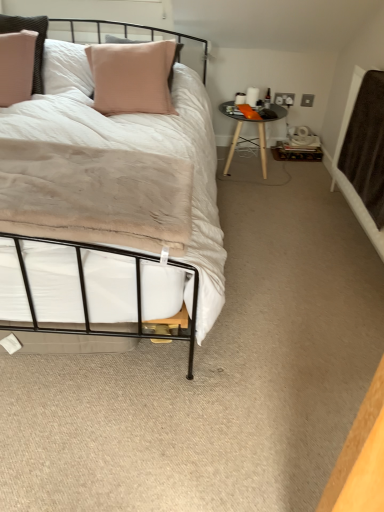
What do you see at coordinates (366, 146) in the screenshot? The width and height of the screenshot is (384, 512). I see `brown textured blanket at right` at bounding box center [366, 146].

You are a GUI agent. You are given a task and a screenshot of the screen. Output one action in this format:
    pyautogui.click(x=<x>, y=<y>)
    Task: Click on the brown textured blanket at right
    The width and height of the screenshot is (384, 512).
    Given the screenshot: What is the action you would take?
    pyautogui.click(x=366, y=146)

Measure the distance between brown textured blanket at right and camera.

A distance of 6.46 feet exists between brown textured blanket at right and camera.

Image resolution: width=384 pixels, height=512 pixels. Find the location of `black glossy table at center right`. black glossy table at center right is located at coordinates (239, 136).

What do you see at coordinates (239, 136) in the screenshot? I see `black glossy table at center right` at bounding box center [239, 136].

Find the location of a particular element. brown textured blanket at right is located at coordinates (366, 146).

Which is more to the right, black glossy table at center right or brown textured blanket at right?

From the viewer's perspective, brown textured blanket at right appears more on the right side.

Is black glossy table at center right behind brown textured blanket at right?

That is True.

Is point (261, 119) closer or farther from the camera than point (367, 140)?

Clearly, point (261, 119) is more distant from the camera than point (367, 140).

Looking at this image, from the image's perspective, which is below, black glossy table at center right or brown textured blanket at right?

brown textured blanket at right, from the image's perspective.

From a real-world perspective, does black glossy table at center right stand above brown textured blanket at right?

No, from a real-world perspective, black glossy table at center right is not on top of brown textured blanket at right.

Is black glossy table at center right wider or thinner than brown textured blanket at right?

black glossy table at center right is wider than brown textured blanket at right.

Does black glossy table at center right have a lesser height compared to brown textured blanket at right?

Correct, black glossy table at center right is not as tall as brown textured blanket at right.

Based on the photo, is black glossy table at center right smaller than brown textured blanket at right?

Actually, black glossy table at center right might be larger than brown textured blanket at right.

Can we say black glossy table at center right lies outside brown textured blanket at right?

Yes, black glossy table at center right is located beyond the bounds of brown textured blanket at right.

Is black glossy table at center right not near brown textured blanket at right?

No, there isn't a large distance between black glossy table at center right and brown textured blanket at right.

Is black glossy table at center right aimed at brown textured blanket at right?

Yes, black glossy table at center right is oriented towards brown textured blanket at right.

This screenshot has height=512, width=384. What are the coordinates of `table lying above the brown textured blanket at right (from the image's perspective)` in the screenshot? It's located at (239, 136).

Is brown textured blanket at right to the left or to the right of black glossy table at center right in the image?

brown textured blanket at right is positioned on black glossy table at center right's right side.

Relative to black glossy table at center right, is brown textured blanket at right in front or behind?

brown textured blanket at right is in front of black glossy table at center right.

Considering the points (366, 182) and (229, 158), which point is in front, point (366, 182) or point (229, 158)?

The point (366, 182) is closer.

From the image's perspective, is brown textured blanket at right over black glossy table at center right?

No, from the image's perspective, brown textured blanket at right is not over black glossy table at center right.

From a real-world perspective, is brown textured blanket at right under black glossy table at center right?

Incorrect, from a real-world perspective, brown textured blanket at right is higher than black glossy table at center right.

Can you confirm if brown textured blanket at right is thinner than black glossy table at center right?

Correct, the width of brown textured blanket at right is less than that of black glossy table at center right.

Between brown textured blanket at right and black glossy table at center right, which one has more height?

With more height is brown textured blanket at right.

Considering the sizes of objects brown textured blanket at right and black glossy table at center right in the image provided, who is bigger, brown textured blanket at right or black glossy table at center right?

Bigger between the two is black glossy table at center right.

Is brown textured blanket at right inside or outside of black glossy table at center right?

brown textured blanket at right lies outside black glossy table at center right.

Is brown textured blanket at right not near black glossy table at center right?

No, brown textured blanket at right is not far away from black glossy table at center right.

Is brown textured blanket at right turned away from black glossy table at center right?

brown textured blanket at right does not have its back to black glossy table at center right.

How many degrees apart are the facing directions of brown textured blanket at right and black glossy table at center right?

The angle between the facing direction of brown textured blanket at right and the facing direction of black glossy table at center right is 90.7 degrees.

This screenshot has width=384, height=512. I want to click on blanket that is above the black glossy table at center right (from a real-world perspective), so click(366, 146).

Locate an element on the screen. The width and height of the screenshot is (384, 512). table behind the brown textured blanket at right is located at coordinates (239, 136).

Locate an element on the screen. The height and width of the screenshot is (512, 384). blanket that appears in front of the black glossy table at center right is located at coordinates (366, 146).